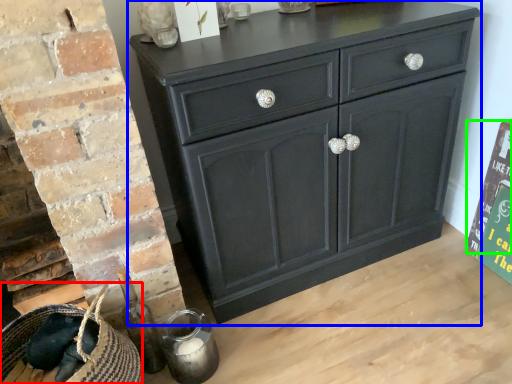
Question: Which object is the farthest from basket (highlighted by a red box)? Choose among these: chest of drawers (highlighted by a blue box) or bulletin board (highlighted by a green box).

Choices:
 (A) chest of drawers
 (B) bulletin board

Answer: (B)